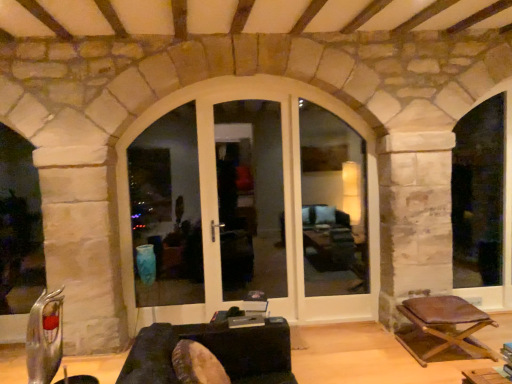
In order to face white glossy door at center, the 3th window frame viewed from the right, should I rotate leftwards or rightwards?

To face it directly, rotate left by 12.003 degrees.

The height and width of the screenshot is (384, 512). What are the coordinates of `white wood window frame at right, the third window frame positioned from the left` in the screenshot? It's located at (479, 195).

Describe the element at coordinates (479, 195) in the screenshot. The image size is (512, 384). I see `white wood window frame at right, positioned as the 1th window frame in right-to-left order` at that location.

What do you see at coordinates (333, 204) in the screenshot?
I see `white glass window at center, arranged as the 2th window frame when viewed from the left` at bounding box center [333, 204].

Describe the element at coordinates (213, 352) in the screenshot. I see `dark brown leather couch at center` at that location.

The image size is (512, 384). What are the coordinates of `white glossy door at center` in the screenshot? It's located at (246, 195).

This screenshot has width=512, height=384. Identify the location of brown leather stool at lower right. (443, 329).

From the image's perspective, is white glossy door at center, acting as the 1th window frame starting from the left, under brown leather stool at lower right?

No, from the image's perspective, white glossy door at center, acting as the 1th window frame starting from the left, is not below brown leather stool at lower right.

Is white glossy door at center, acting as the 1th window frame starting from the left, facing towards brown leather stool at lower right?

No, white glossy door at center, acting as the 1th window frame starting from the left, is not turned towards brown leather stool at lower right.

Based on the photo, between white glossy door at center, the 3th window frame viewed from the right, and brown leather stool at lower right, which one is positioned in front?

brown leather stool at lower right is closer to the camera.

Looking at the image, does white glass door at center seem bigger or smaller compared to white glossy door at center?

In the image, white glass door at center appears to be larger than white glossy door at center.

Can you confirm if white glass door at center is shorter than white glossy door at center?

Yes.

Identify the location of door that is on the left side of white glossy door at center. The width and height of the screenshot is (512, 384). (284, 200).

Between brown leather stool at lower right and dark brown leather couch at center, which one has larger size?

dark brown leather couch at center is bigger.

Which object is further away from the camera taking this photo, brown leather stool at lower right or dark brown leather couch at center?

brown leather stool at lower right is further from the camera.

From the image's perspective, which one is positioned higher, brown leather stool at lower right or dark brown leather couch at center?

dark brown leather couch at center is shown above in the image.

Choose the correct answer: Is brown leather stool at lower right inside dark brown leather couch at center or outside it?

brown leather stool at lower right is located beyond the bounds of dark brown leather couch at center.

From a real-world perspective, which is physically above, dark brown leather couch at center or white glossy door at center, acting as the 1th window frame starting from the left?

In real-world perspective, white glossy door at center, acting as the 1th window frame starting from the left, is above.

Is white glossy door at center, the 3th window frame viewed from the right, at the back of dark brown leather couch at center?

No, white glossy door at center, the 3th window frame viewed from the right, is not at the back of dark brown leather couch at center.

Considering the sizes of objects dark brown leather couch at center and white glossy door at center, the 3th window frame viewed from the right, in the image provided, who is smaller, dark brown leather couch at center or white glossy door at center, the 3th window frame viewed from the right,?

Smaller between the two is white glossy door at center, the 3th window frame viewed from the right.

Looking at this image, is the depth of white wood window frame at right, positioned as the 1th window frame in right-to-left order, greater than that of white glass window at center, arranged as the second window frame when viewed from the right?

Yes, white wood window frame at right, positioned as the 1th window frame in right-to-left order, is further from the camera.

From the picture: Measure the distance between white wood window frame at right, positioned as the 1th window frame in right-to-left order, and white glass window at center, arranged as the 2th window frame when viewed from the left.

white wood window frame at right, positioned as the 1th window frame in right-to-left order, is 4.70 feet away from white glass window at center, arranged as the 2th window frame when viewed from the left.

Can you confirm if white wood window frame at right, positioned as the 1th window frame in right-to-left order, is smaller than white glass window at center, arranged as the second window frame when viewed from the right?

Actually, white wood window frame at right, positioned as the 1th window frame in right-to-left order, might be larger than white glass window at center, arranged as the second window frame when viewed from the right.

Is white wood window frame at right, the third window frame positioned from the left, positioned with its back to white glass window at center, arranged as the second window frame when viewed from the right?

white wood window frame at right, the third window frame positioned from the left, does not have its back to white glass window at center, arranged as the second window frame when viewed from the right.

Can you tell me how much white glass door at center and brown leather stool at lower right differ in facing direction?

There is a 0.692-degree angle between the facing directions of white glass door at center and brown leather stool at lower right.

Is point (206, 232) closer or farther from the camera than point (460, 316)?

Point (206, 232) is positioned farther from the camera compared to point (460, 316).

Is white glass door at center far away from brown leather stool at lower right?

white glass door at center is positioned a significant distance from brown leather stool at lower right.

From a real-world perspective, which is physically above, white glass door at center or brown leather stool at lower right?

white glass door at center.

Who is smaller, white glossy door at center or dark brown leather couch at center?

Smaller between the two is white glossy door at center.

How much distance is there between white glossy door at center and dark brown leather couch at center?

8.55 feet.

Is white glossy door at center beside dark brown leather couch at center?

No, white glossy door at center is not in contact with dark brown leather couch at center.

Considering the relative sizes of white glossy door at center and dark brown leather couch at center in the image provided, is white glossy door at center taller than dark brown leather couch at center?

Indeed, white glossy door at center has a greater height compared to dark brown leather couch at center.

Find the location of a particular element. the 1st window frame behind the brown leather stool at lower right, counting from the anchor's position is located at coordinates (166, 211).

Image resolution: width=512 pixels, height=384 pixels. Identify the location of door located underneath the white glossy door at center (from a real-world perspective). (284, 200).

From the picture: Which object lies nearer to the anchor point white glossy door at center, acting as the 1th window frame starting from the left, white glass door at center or white wood window frame at right, the third window frame positioned from the left?

white glass door at center is closer to white glossy door at center, acting as the 1th window frame starting from the left.

When comparing their distances from white glossy door at center, acting as the 1th window frame starting from the left, does white glossy door at center or white wood window frame at right, positioned as the 1th window frame in right-to-left order, seem closer?

white glossy door at center.

Which object lies nearer to the anchor point white wood window frame at right, the third window frame positioned from the left, dark brown leather couch at center or white glass window at center, arranged as the second window frame when viewed from the right?

Based on the image, white glass window at center, arranged as the second window frame when viewed from the right, appears to be nearer to white wood window frame at right, the third window frame positioned from the left.

When comparing their distances from white glossy door at center, the 3th window frame viewed from the right, does white glossy door at center or dark brown leather couch at center seem closer?

Based on the image, white glossy door at center appears to be nearer to white glossy door at center, the 3th window frame viewed from the right.

When comparing their distances from white glass window at center, arranged as the 2th window frame when viewed from the left, does white glass door at center or white glossy door at center seem closer?

white glossy door at center.

In the scene shown: When comparing their distances from white glass window at center, arranged as the 2th window frame when viewed from the left, does dark brown leather couch at center or white glass door at center seem further?

dark brown leather couch at center.

Based on their spatial positions, is white glass window at center, arranged as the second window frame when viewed from the right, or white glossy door at center closer to white glass door at center?

white glossy door at center is closer to white glass door at center.

From the image, which object appears to be farther from white glossy door at center, the 3th window frame viewed from the right, white glossy door at center or brown leather stool at lower right?

brown leather stool at lower right.

At what (x,y) coordinates should I click in order to perform the action: click on chair between dark brown leather couch at center and white wood window frame at right, positioned as the 1th window frame in right-to-left order, in the horizontal direction. Please return your answer as a coordinate pair (x, y). Looking at the image, I should click on (443, 329).

I want to click on window frame situated between white glass door at center and white wood window frame at right, the third window frame positioned from the left, from left to right, so click(333, 204).

The image size is (512, 384). What are the coordinates of `studio couch between white glossy door at center, the 3th window frame viewed from the right, and white wood window frame at right, the third window frame positioned from the left` in the screenshot? It's located at (213, 352).

Where is `screen door situated between white glass door at center and white wood window frame at right, the third window frame positioned from the left, from left to right`? screen door situated between white glass door at center and white wood window frame at right, the third window frame positioned from the left, from left to right is located at coordinates (246, 195).